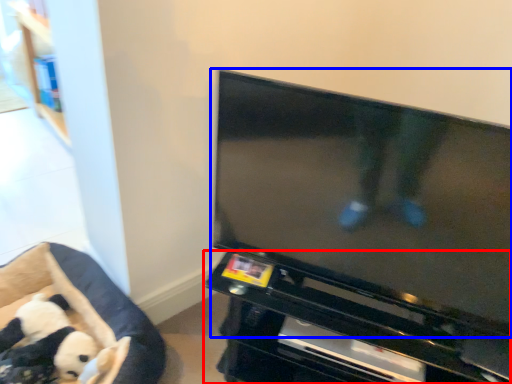
Question: Which of the following is the farthest to the observer, entertainment center (highlighted by a red box) or television (highlighted by a blue box)?

Choices:
 (A) entertainment center
 (B) television

Answer: (A)